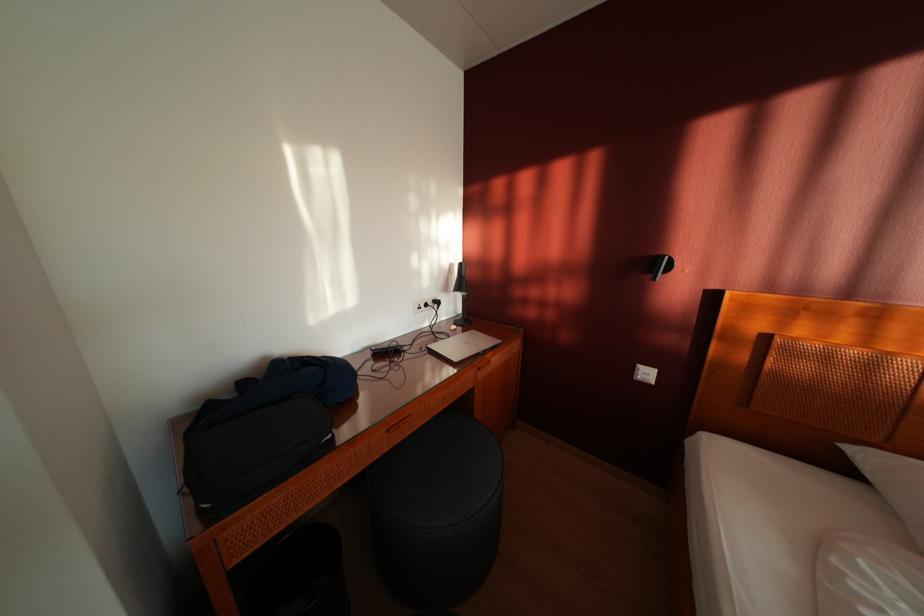
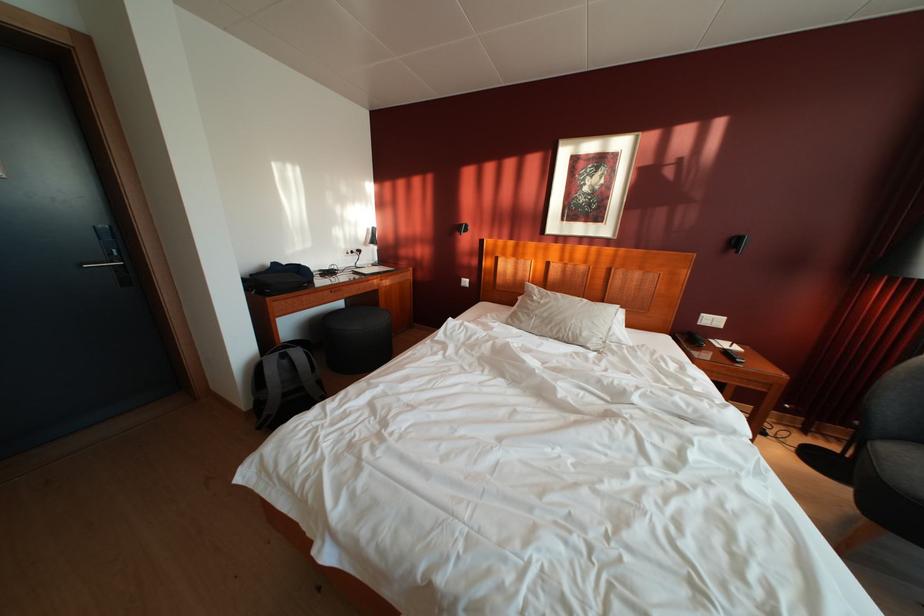
Where in the second image is the point corresponding to (468,315) from the first image?

(384, 265)